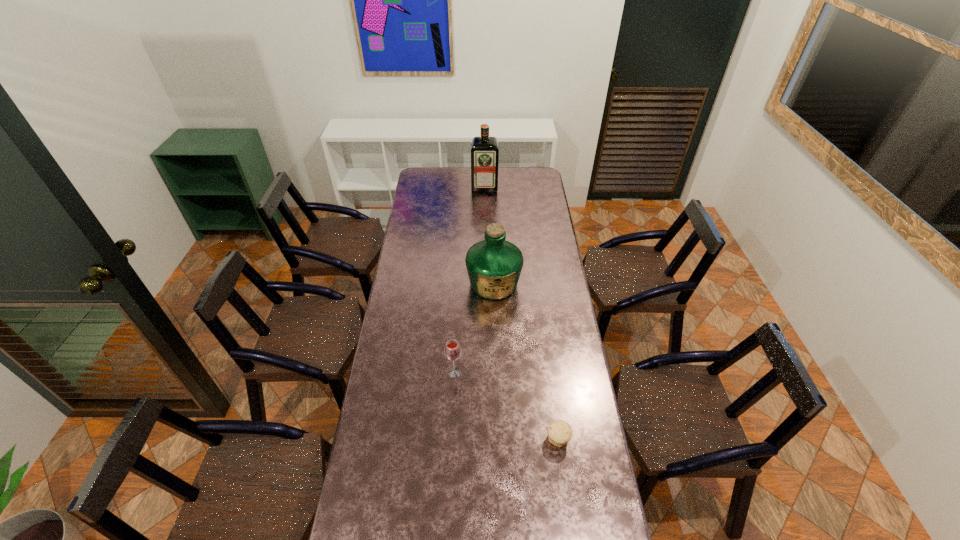
I want to click on vacant space situated 0.210m on the right of the third tallest object, so click(x=515, y=372).

At what (x,y) coordinates should I click in order to perform the action: click on vacant region located 0.260m on the back of the rightmost object. Please return your answer as a coordinate pair (x, y). Looking at the image, I should click on (548, 368).

The width and height of the screenshot is (960, 540). What are the coordinates of `object that is positioned at the far edge` in the screenshot? It's located at (484, 150).

Image resolution: width=960 pixels, height=540 pixels. In order to click on object present at the right edge in this screenshot , I will do `click(559, 432)`.

At what (x,y) coordinates should I click in order to perform the action: click on free space at the left edge. Please return your answer as a coordinate pair (x, y). Looking at the image, I should click on (378, 435).

Find the location of `free location at the right edge of the desktop`. free location at the right edge of the desktop is located at coordinates (530, 227).

Find the location of `vacant space that's between the second tallest object and the leftmost object`. vacant space that's between the second tallest object and the leftmost object is located at coordinates (474, 328).

Find the location of a particular element. Image resolution: width=960 pixels, height=540 pixels. vacant point located between the muffin and the second tallest object is located at coordinates (526, 361).

Where is `vacant space that's between the muffin and the nearer liquor`? vacant space that's between the muffin and the nearer liquor is located at coordinates coord(526,361).

I want to click on unoccupied position between the shorter liquor and the rightmost object, so click(x=526, y=361).